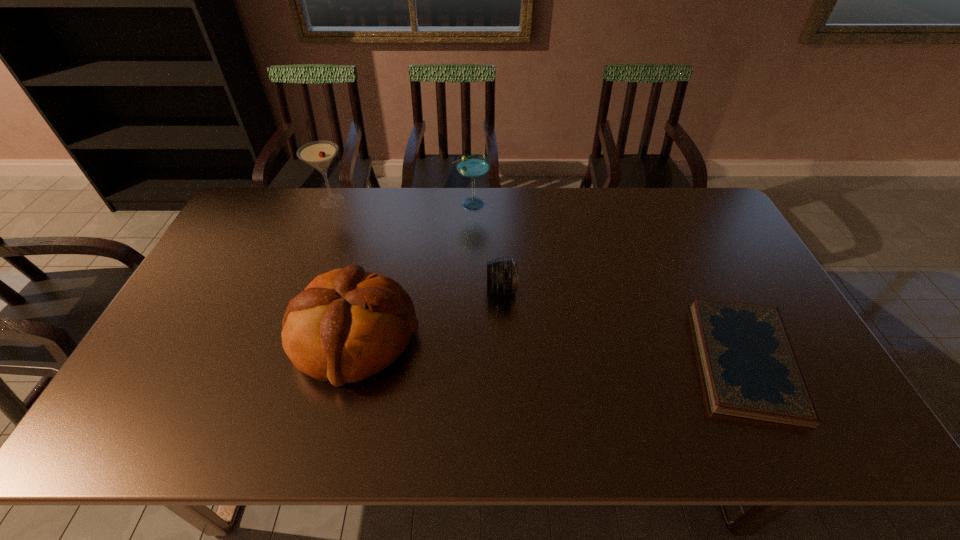
Find the location of a particular element. the left martini is located at coordinates (319, 154).

What are the coordinates of `the taller martini` in the screenshot? It's located at (319, 154).

You are a GUI agent. You are given a task and a screenshot of the screen. Output one action in this format:
    pyautogui.click(x=<x>, y=<y>)
    Task: Click on the right martini
    Image resolution: width=960 pixels, height=540 pixels.
    Given the screenshot: What is the action you would take?
    pyautogui.click(x=471, y=165)

Identify the location of bread. (348, 324).

Image resolution: width=960 pixels, height=540 pixels. Find the location of `telephoto lens`. telephoto lens is located at coordinates (502, 272).

You are a GUI agent. You are given a task and a screenshot of the screen. Output one action in this format:
    pyautogui.click(x=<x>, y=<y>)
    Task: Click on the shortest object
    The height and width of the screenshot is (540, 960).
    Given the screenshot: What is the action you would take?
    pyautogui.click(x=750, y=368)

This screenshot has height=540, width=960. In order to click on paperback book in this screenshot , I will do `click(750, 368)`.

You are a GUI agent. You are given a task and a screenshot of the screen. Output one action in this format:
    pyautogui.click(x=<x>, y=<y>)
    Task: Click on the vacant region located 0.170m on the left of the tallest object
    The image size is (960, 540).
    Given the screenshot: What is the action you would take?
    pyautogui.click(x=267, y=201)

Where is `vacant space located 0.220m on the left of the right martini`? This screenshot has height=540, width=960. vacant space located 0.220m on the left of the right martini is located at coordinates pyautogui.click(x=394, y=203).

The height and width of the screenshot is (540, 960). I want to click on vacant area situated 0.150m on the right of the bread, so click(476, 336).